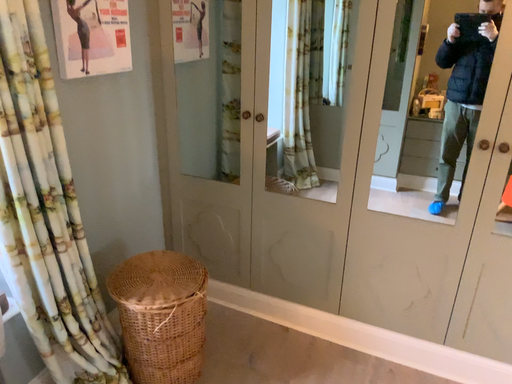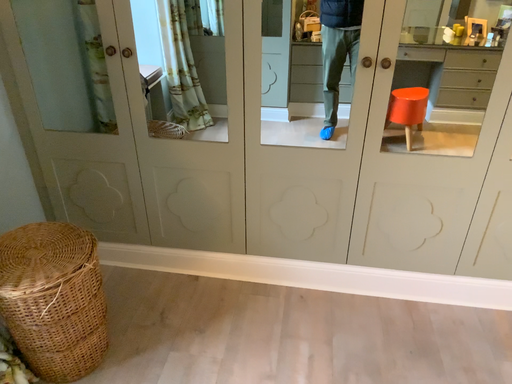
Question: Which way did the camera rotate in the video?

Choices:
 (A) rotated downward
 (B) rotated upward

Answer: (A)